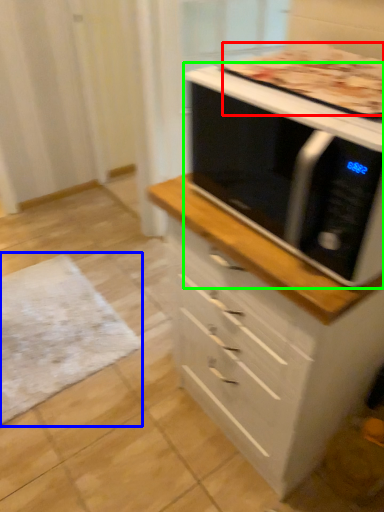
Question: Which object is positioned farthest from pizza (highlighted by a red box)? Select from mat (highlighted by a blue box) and microwave oven (highlighted by a green box).

Choices:
 (A) mat
 (B) microwave oven

Answer: (A)